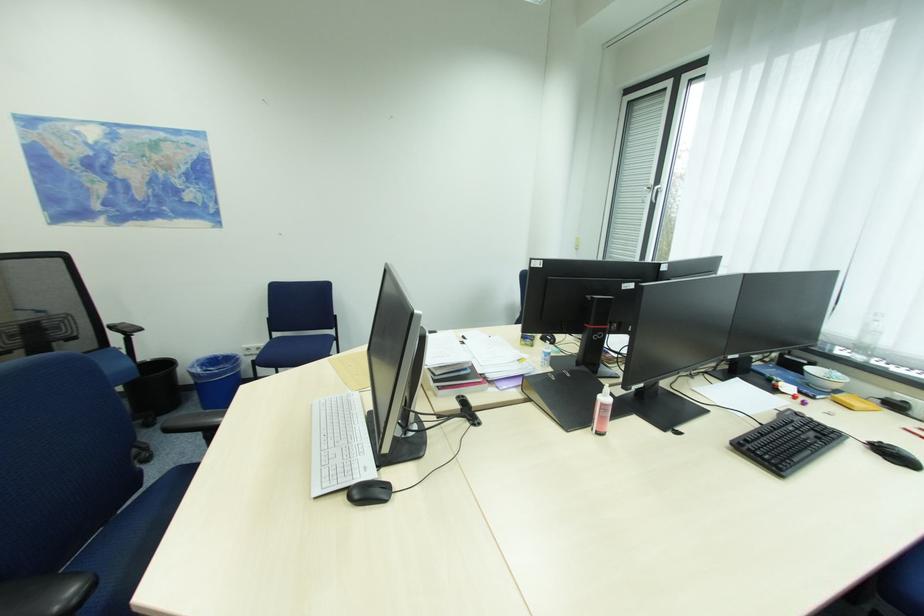
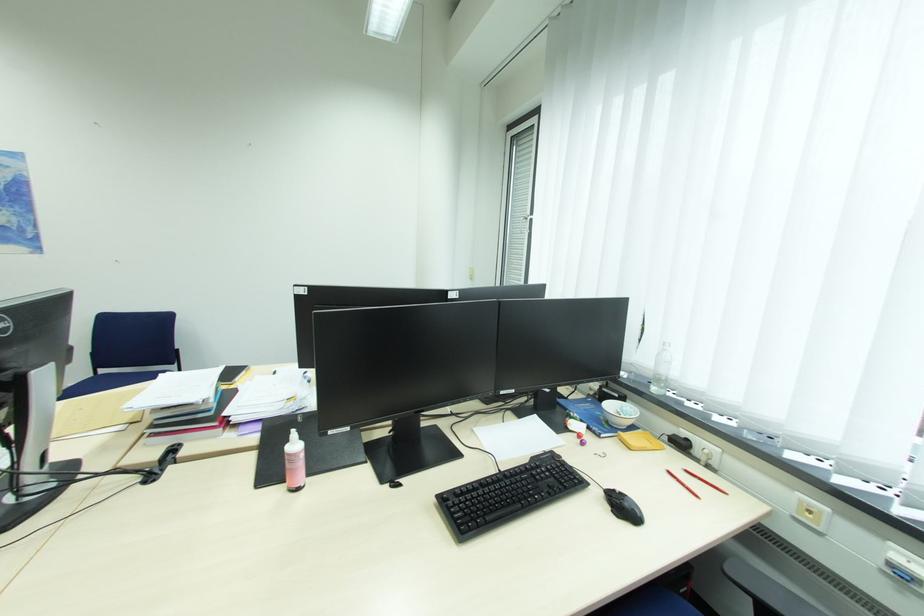
Question: The images are taken continuously from a first-person perspective. In which direction is your viewpoint rotating?

Choices:
 (A) Left
 (B) Right
 (C) Up
 (D) Down

Answer: (C)